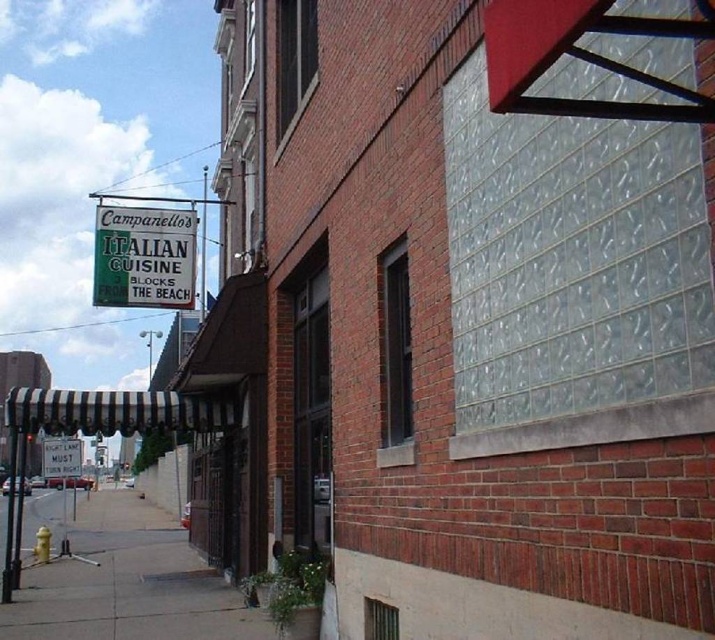
Locate an element on the screen. Image resolution: width=715 pixels, height=640 pixels. gray concrete sidewalk at lower left is located at coordinates (128, 582).

Between point (209, 573) and point (112, 224), which one is positioned behind?

Point (209, 573)

Find the location of a particular element. gray concrete sidewalk at lower left is located at coordinates (128, 582).

Does gray concrete sidewalk at lower left have a greater height compared to white plastic sign at lower left?

No, gray concrete sidewalk at lower left is not taller than white plastic sign at lower left.

Is gray concrete sidewalk at lower left above white plastic sign at lower left?

No, gray concrete sidewalk at lower left is not above white plastic sign at lower left.

Does point (149, 582) lie behind point (66, 472)?

No, (149, 582) is in front of (66, 472).

Identify the location of gray concrete sidewalk at lower left. (128, 582).

Where is `green paper sign at upper left`? This screenshot has width=715, height=640. green paper sign at upper left is located at coordinates (144, 257).

Can you confirm if green paper sign at upper left is positioned above white plastic sign at lower left?

Correct, green paper sign at upper left is located above white plastic sign at lower left.

Describe the element at coordinates (144, 257) in the screenshot. The image size is (715, 640). I see `green paper sign at upper left` at that location.

The height and width of the screenshot is (640, 715). I want to click on green paper sign at upper left, so pyautogui.click(x=144, y=257).